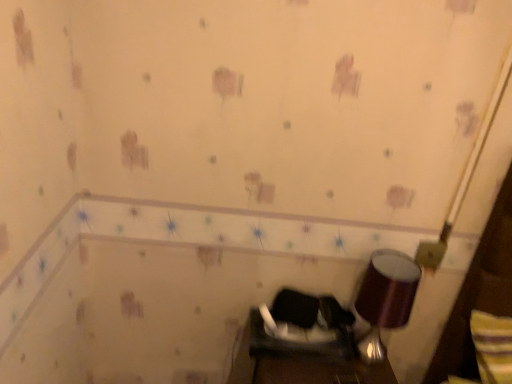
Question: Is black fabric swivel chair at center next to shiny metallic lampshade at lower right and touching it?

Choices:
 (A) no
 (B) yes

Answer: (A)

Question: Does black fabric swivel chair at center have a greater width compared to shiny metallic lampshade at lower right?

Choices:
 (A) yes
 (B) no

Answer: (B)

Question: Is black fabric swivel chair at center at the left side of shiny metallic lampshade at lower right?

Choices:
 (A) yes
 (B) no

Answer: (A)

Question: Is black fabric swivel chair at center at the right side of shiny metallic lampshade at lower right?

Choices:
 (A) yes
 (B) no

Answer: (B)

Question: Is black fabric swivel chair at center positioned behind shiny metallic lampshade at lower right?

Choices:
 (A) no
 (B) yes

Answer: (B)

Question: Can you confirm if black fabric swivel chair at center is shorter than shiny metallic lampshade at lower right?

Choices:
 (A) yes
 (B) no

Answer: (A)

Question: Could you tell me if shiny metallic lampshade at lower right is turned towards black fabric swivel chair at center?

Choices:
 (A) no
 (B) yes

Answer: (A)

Question: Is shiny metallic lampshade at lower right facing away from black fabric swivel chair at center?

Choices:
 (A) yes
 (B) no

Answer: (B)

Question: From a real-world perspective, does shiny metallic lampshade at lower right sit lower than black fabric swivel chair at center?

Choices:
 (A) yes
 (B) no

Answer: (B)

Question: Is shiny metallic lampshade at lower right to the left of black fabric swivel chair at center from the viewer's perspective?

Choices:
 (A) no
 (B) yes

Answer: (A)

Question: Does shiny metallic lampshade at lower right have a greater height compared to black fabric swivel chair at center?

Choices:
 (A) yes
 (B) no

Answer: (A)

Question: Would you say shiny metallic lampshade at lower right is a long distance from black fabric swivel chair at center?

Choices:
 (A) no
 (B) yes

Answer: (A)

Question: From the image's perspective, is shiny metallic lampshade at lower right located above or below black fabric swivel chair at center?

Choices:
 (A) below
 (B) above

Answer: (B)